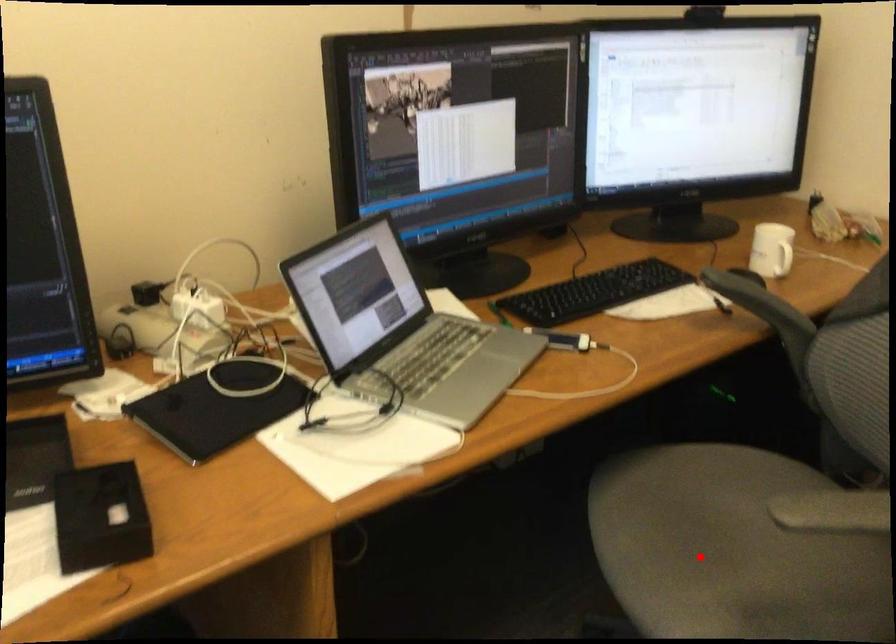
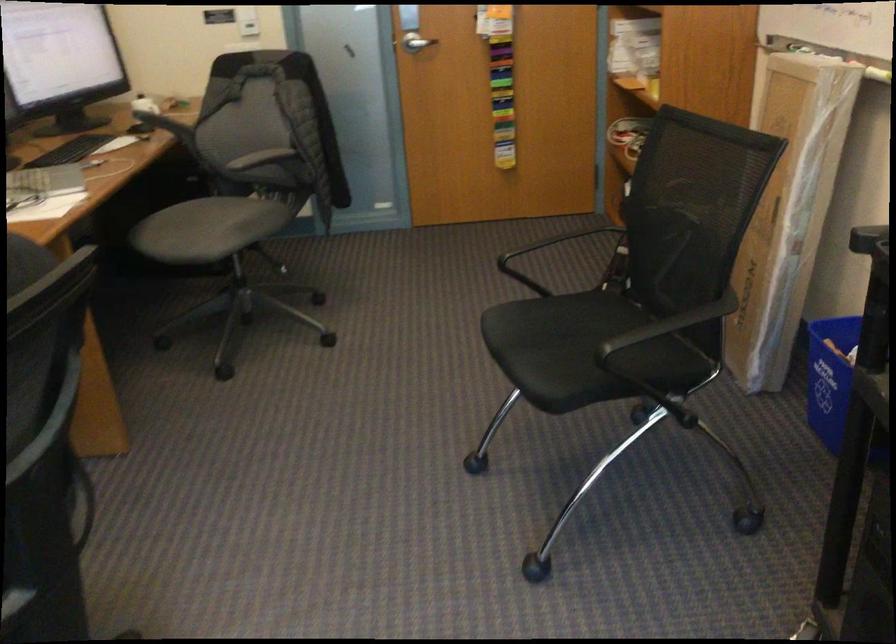
Question: A red point is marked in image1. In image2, is the corresponding 3D point closer to the camera or farther? Reply with the corresponding letter.

Choices:
 (A) The corresponding 3D point is closer.
 (B) The corresponding 3D point is farther.

Answer: (B)